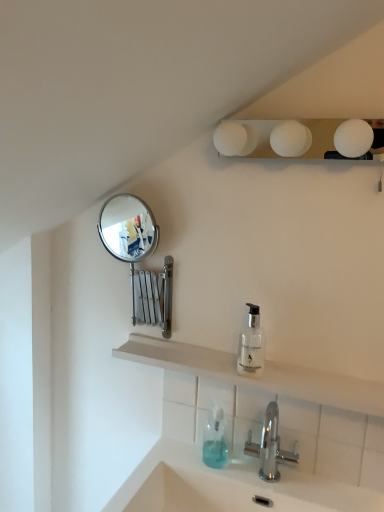
Question: Relative to translucent plastic soap dispenser at lower center, which is the first soap dispenser in left-to-right order, is silver metallic mirror at upper left in front or behind?

Choices:
 (A) front
 (B) behind

Answer: (B)

Question: Is point (150, 227) positioned closer to the camera than point (216, 442)?

Choices:
 (A) farther
 (B) closer

Answer: (A)

Question: Estimate the real-world distances between objects in this image. Which object is closer to the translucent plastic soap dispenser at lower center, which is the first soap dispenser in left-to-right order?

Choices:
 (A) chrome metallic faucet at lower center
 (B) silver metallic mirror at upper left
 (C) transparent glass soap dispenser at center, the 2th soap dispenser from the left
 (D) white matte light fixture at upper center
 (E) white matte shelf at center

Answer: (A)

Question: Which is nearer to the translucent plastic soap dispenser at lower center, placed as the first soap dispenser when sorted from bottom to top?

Choices:
 (A) white matte shelf at center
 (B) white glossy sink at lower center
 (C) white matte light fixture at upper center
 (D) transparent glass soap dispenser at center, the first soap dispenser viewed from the right
 (E) chrome metallic faucet at lower center

Answer: (E)